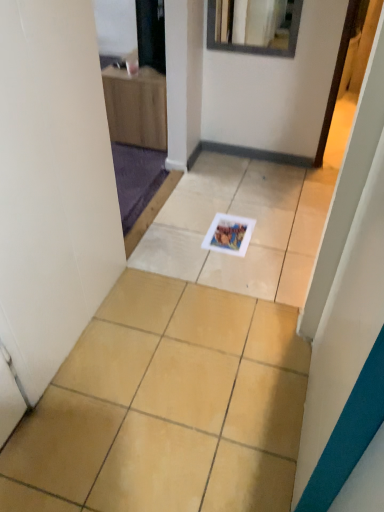
You are a GUI agent. You are given a task and a screenshot of the screen. Output one action in this format:
    pyautogui.click(x=<x>, y=<y>)
    Task: Click on the blank space to the left of white glossy magazine at center
    
    Given the screenshot: What is the action you would take?
    180,242